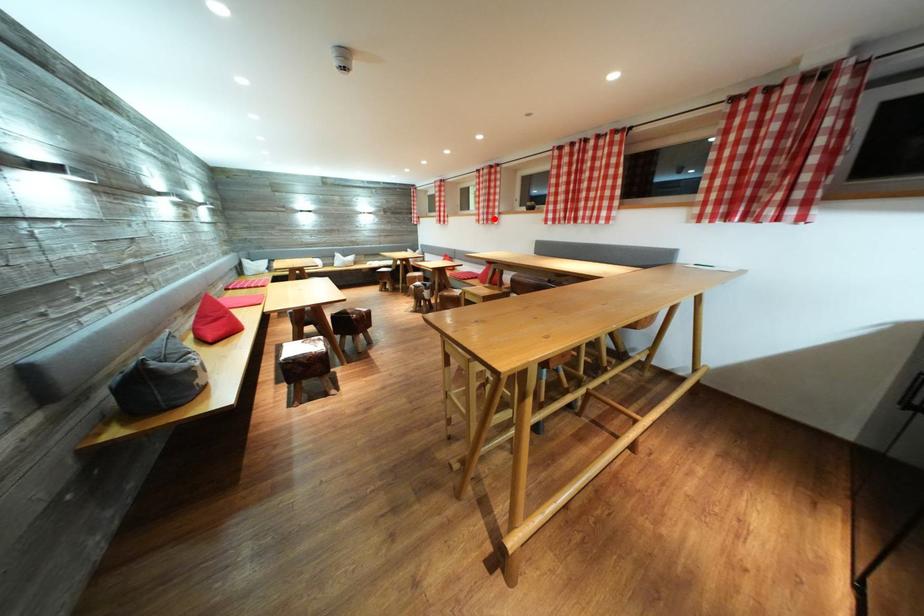
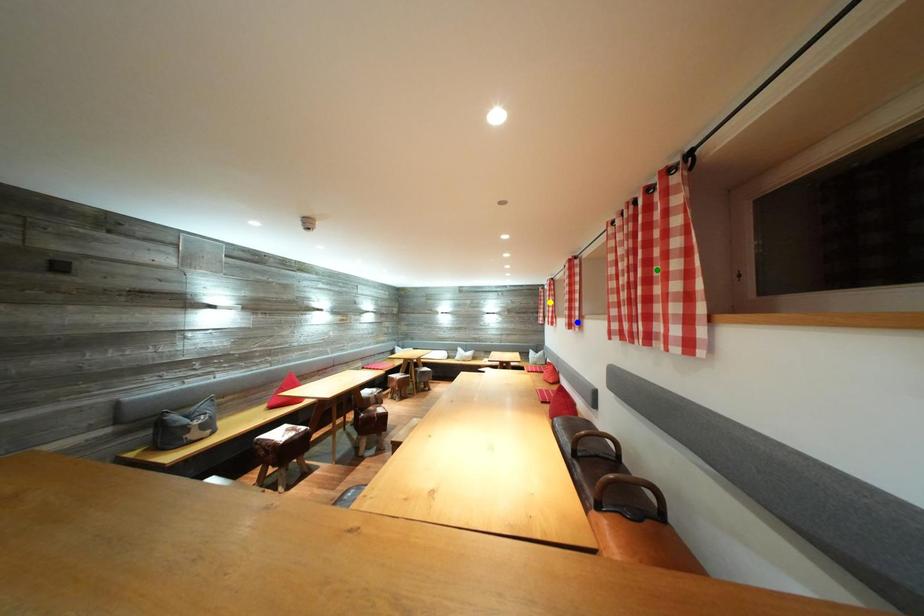
Question: I am providing you with two images of the same scene from different viewpoints. A red point is marked on the first image. You are given multiple points on the second image. Which mark in image 2 goes with the point in image 1?

Choices:
 (A) blue point
 (B) green point
 (C) yellow point

Answer: (A)